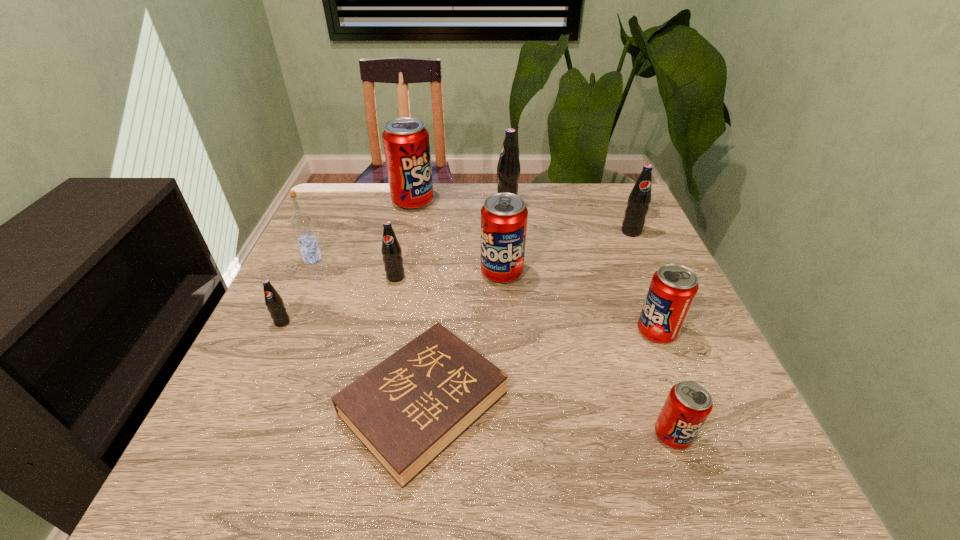
Find the location of a particular element. the leftmost red soda can is located at coordinates (406, 143).

Where is `the farthest red soda can`? This screenshot has height=540, width=960. the farthest red soda can is located at coordinates (406, 143).

This screenshot has width=960, height=540. What are the coordinates of `the third black pop from left to right` in the screenshot? It's located at click(508, 168).

Where is `the farthest black pop`? The width and height of the screenshot is (960, 540). the farthest black pop is located at coordinates (508, 168).

Locate an element on the screen. the third nearest black pop is located at coordinates (639, 199).

Find the location of `the rightmost black pop`. the rightmost black pop is located at coordinates (639, 199).

In order to click on the second farthest red soda can in this screenshot , I will do `click(504, 216)`.

Where is `the second red soda can from left to right`? Image resolution: width=960 pixels, height=540 pixels. the second red soda can from left to right is located at coordinates (504, 216).

Locate an element on the screen. The width and height of the screenshot is (960, 540). vodka is located at coordinates pyautogui.click(x=301, y=222).

Locate an element on the screen. This screenshot has height=540, width=960. the third biggest black pop is located at coordinates (391, 251).